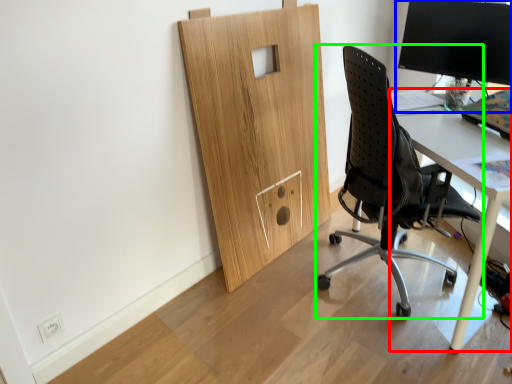
Question: Which is farther away from desk (highlighted by a red box)? desktop computer (highlighted by a blue box) or chair (highlighted by a green box)?

Choices:
 (A) desktop computer
 (B) chair

Answer: (A)